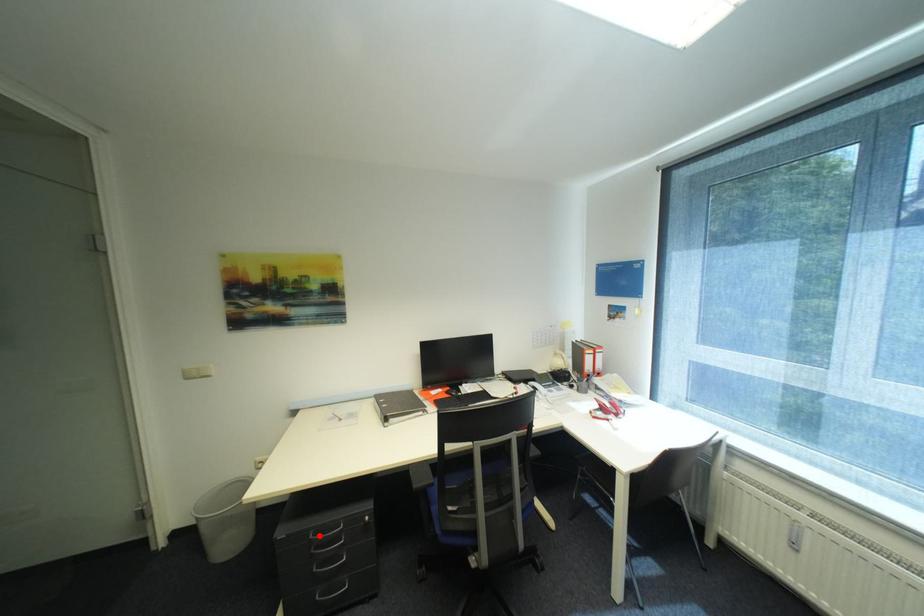
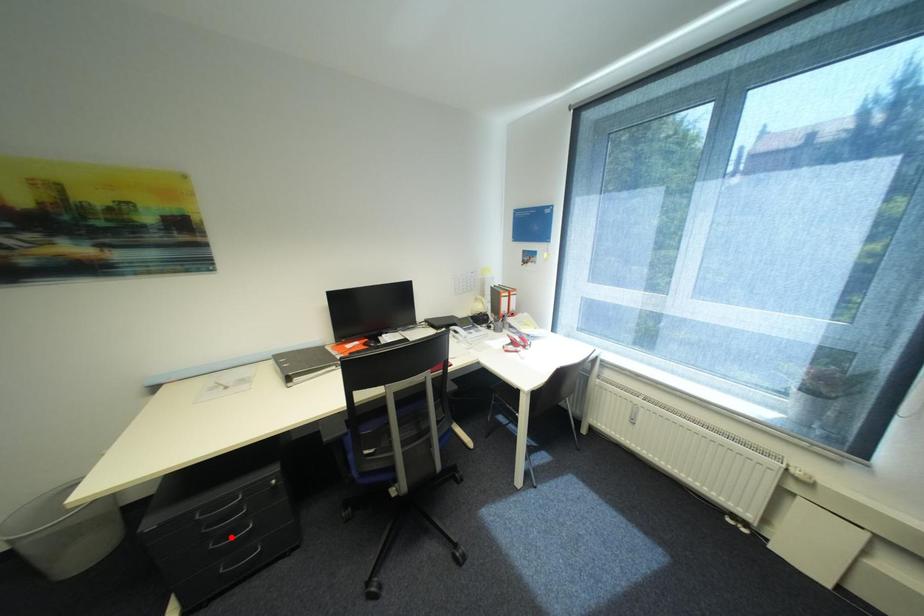
I am providing you with two images of the same scene from different viewpoints. A red point is marked on the first image and another point is marked on the second image. Is the red point in image1 aligned with the point shown in image2?

No